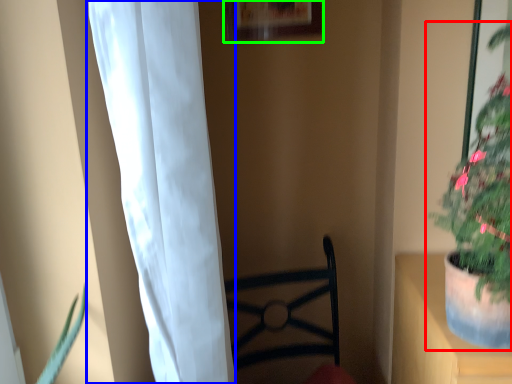
Question: Which object is positioned closest to houseplant (highlighted by a red box)? Select from curtain (highlighted by a blue box) and picture frame (highlighted by a green box).

Choices:
 (A) curtain
 (B) picture frame

Answer: (A)